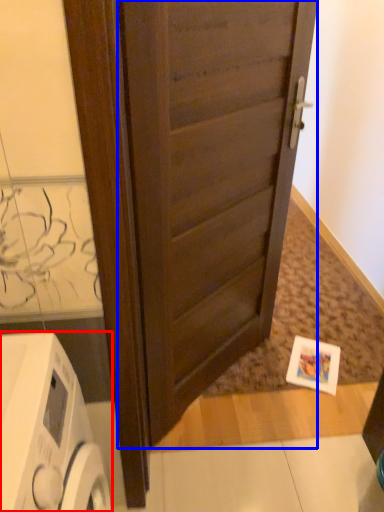
Question: Among these objects, which one is nearest to the camera, home appliance (highlighted by a red box) or door (highlighted by a blue box)?

Choices:
 (A) home appliance
 (B) door

Answer: (A)